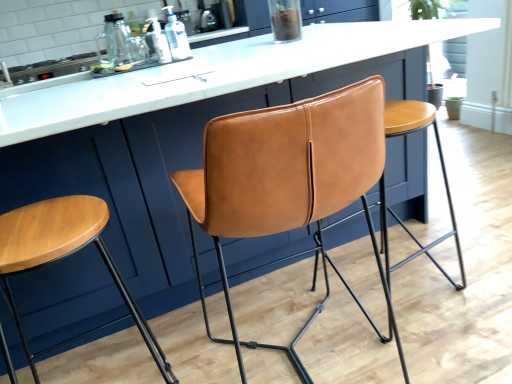
I want to click on free spot to the right of clear plastic bottle at center, which is the first bottle from right to left, so click(x=216, y=48).